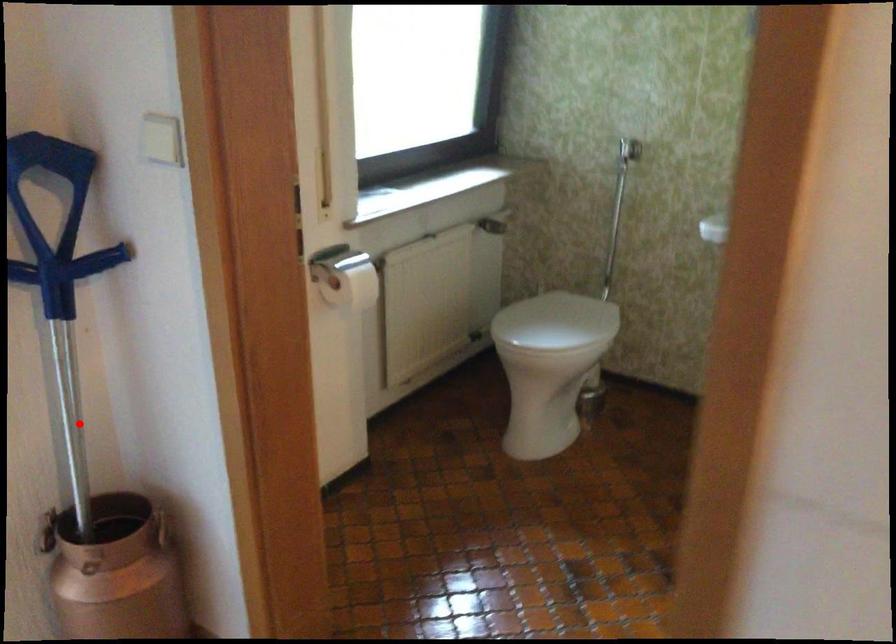
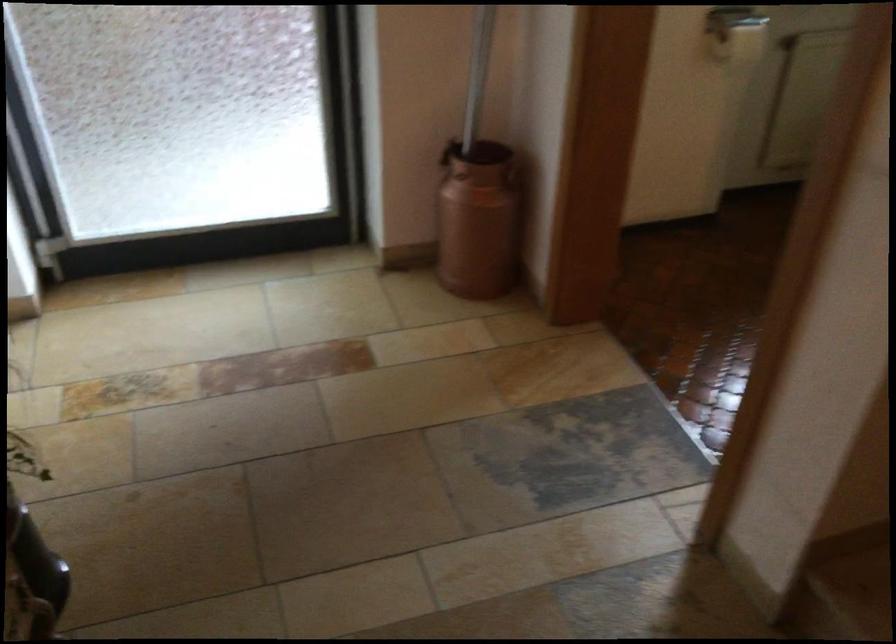
Question: I am providing you with two images of the same scene from different viewpoints. A red point is shown in image1. For the corresponding object point in image2, is it positioned nearer or farther from the camera?

Choices:
 (A) Nearer
 (B) Farther

Answer: (B)